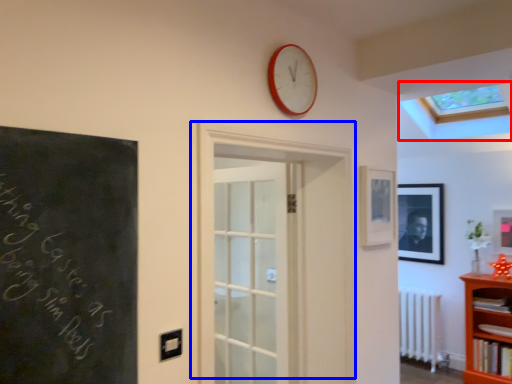
Question: Which object appears closest to the camera in this image, window (highlighted by a red box) or door (highlighted by a blue box)?

Choices:
 (A) window
 (B) door

Answer: (B)